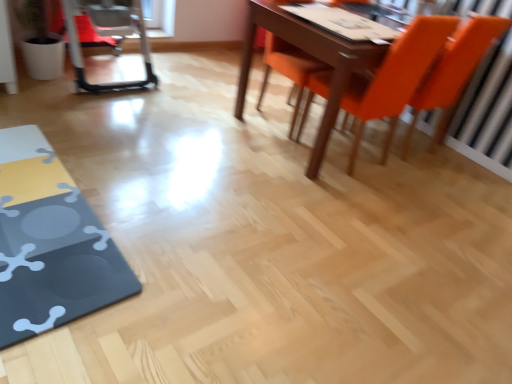
Question: Does orange matte chair at upper right, which appears as the third chair when viewed from the right, have a lesser height compared to orange matte chair at upper right, the 2th chair positioned from the right?

Choices:
 (A) yes
 (B) no

Answer: (A)

Question: Is orange matte chair at upper right, which appears as the third chair when viewed from the right, located outside orange matte chair at upper right, the 2th chair positioned from the right?

Choices:
 (A) yes
 (B) no

Answer: (A)

Question: Is orange matte chair at upper right, the 1th chair when ordered from left to right, to the right of orange matte chair at upper right, the 2th chair positioned from the right, from the viewer's perspective?

Choices:
 (A) no
 (B) yes

Answer: (A)

Question: Considering the relative positions of orange matte chair at upper right, which appears as the third chair when viewed from the right, and orange matte chair at upper right, the 2th chair positioned from the right, in the image provided, is orange matte chair at upper right, which appears as the third chair when viewed from the right, to the left of orange matte chair at upper right, the 2th chair positioned from the right, from the viewer's perspective?

Choices:
 (A) yes
 (B) no

Answer: (A)

Question: Can you confirm if orange matte chair at upper right, which appears as the third chair when viewed from the right, is wider than orange matte chair at upper right, the 2th chair positioned from the right?

Choices:
 (A) no
 (B) yes

Answer: (A)

Question: Could orange matte chair at upper right, acting as the second chair starting from the left, be considered to be inside orange matte chair at upper right, which appears as the third chair when viewed from the right?

Choices:
 (A) yes
 (B) no

Answer: (B)

Question: From the image's perspective, would you say orange matte chair at right, which is the third chair from left to right, is positioned over orange matte chair at upper right, the 2th chair positioned from the right?

Choices:
 (A) yes
 (B) no

Answer: (A)

Question: Would you consider orange matte chair at right, the first chair in the right-to-left sequence, to be distant from orange matte chair at upper right, the 2th chair positioned from the right?

Choices:
 (A) yes
 (B) no

Answer: (B)

Question: Is orange matte chair at right, the first chair in the right-to-left sequence, oriented away from orange matte chair at upper right, the 2th chair positioned from the right?

Choices:
 (A) yes
 (B) no

Answer: (B)

Question: Is orange matte chair at right, the first chair in the right-to-left sequence, aimed at orange matte chair at upper right, the 2th chair positioned from the right?

Choices:
 (A) no
 (B) yes

Answer: (A)

Question: Does orange matte chair at right, which is the third chair from left to right, have a lesser height compared to orange matte chair at upper right, acting as the second chair starting from the left?

Choices:
 (A) no
 (B) yes

Answer: (A)

Question: Is orange matte chair at right, which is the third chair from left to right, directly adjacent to orange matte chair at upper right, the 2th chair positioned from the right?

Choices:
 (A) yes
 (B) no

Answer: (B)

Question: Is metallic silver swivel chair at left closer to the viewer compared to orange matte chair at upper right, the 1th chair when ordered from left to right?

Choices:
 (A) no
 (B) yes

Answer: (A)